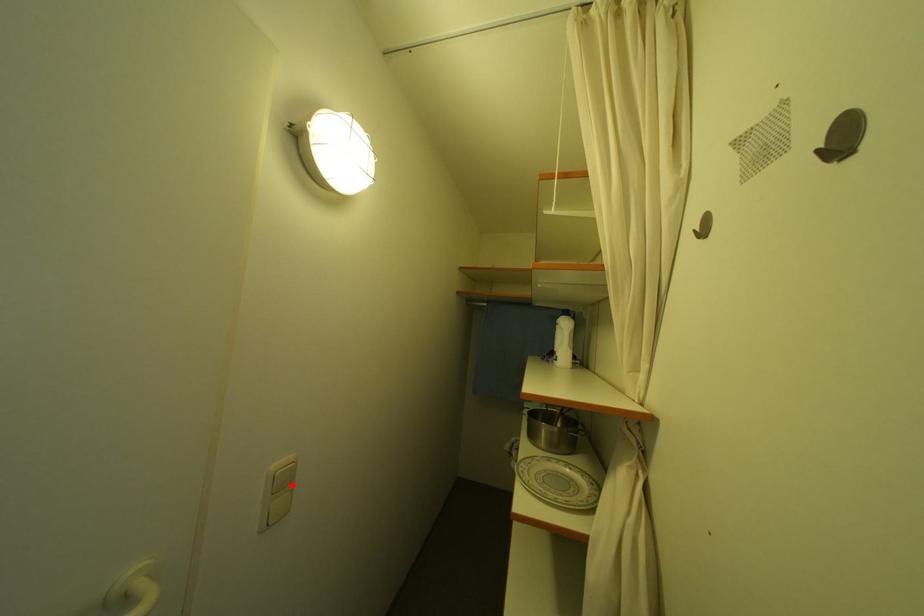
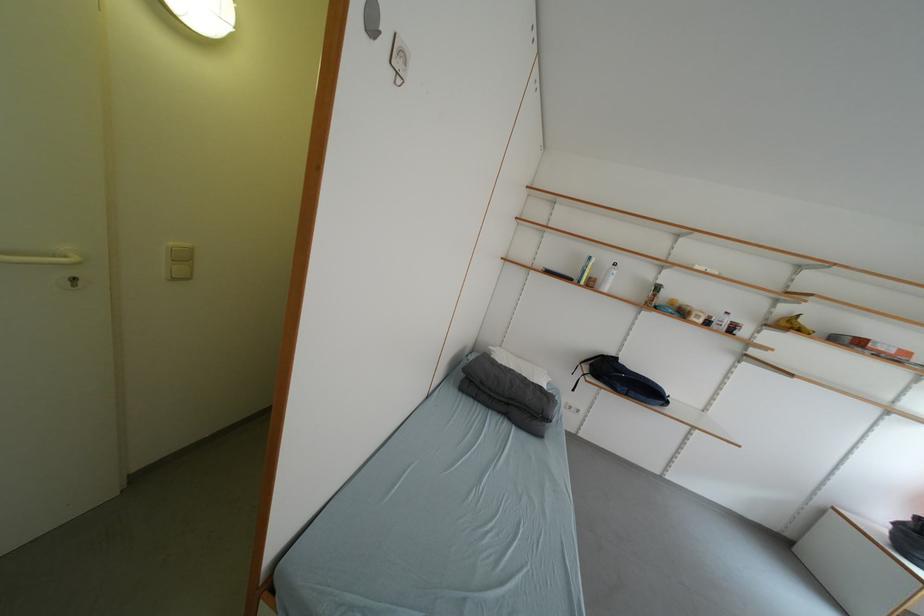
Locate, in the second image, the point that corresponds to the highlighted location in the first image.

(191, 261)